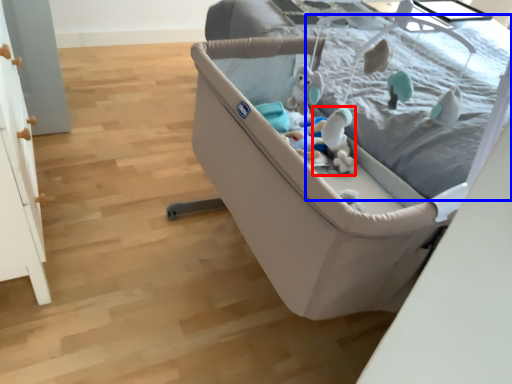
Question: Which point is closer to the camera, toy (highlighted by a red box) or mattress (highlighted by a blue box)?

Choices:
 (A) toy
 (B) mattress

Answer: (B)